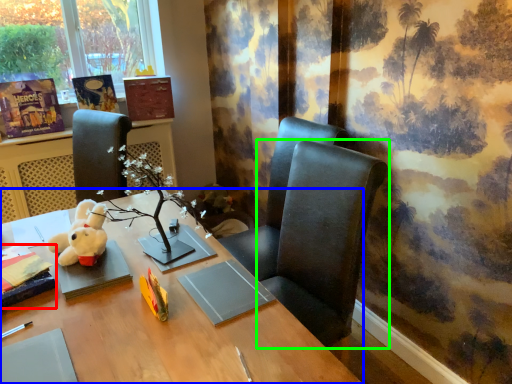
Question: Estimate the real-world distances between objects in this image. Which object is closer to book (highlighted by a red box), desk (highlighted by a blue box) or chair (highlighted by a green box)?

Choices:
 (A) desk
 (B) chair

Answer: (A)